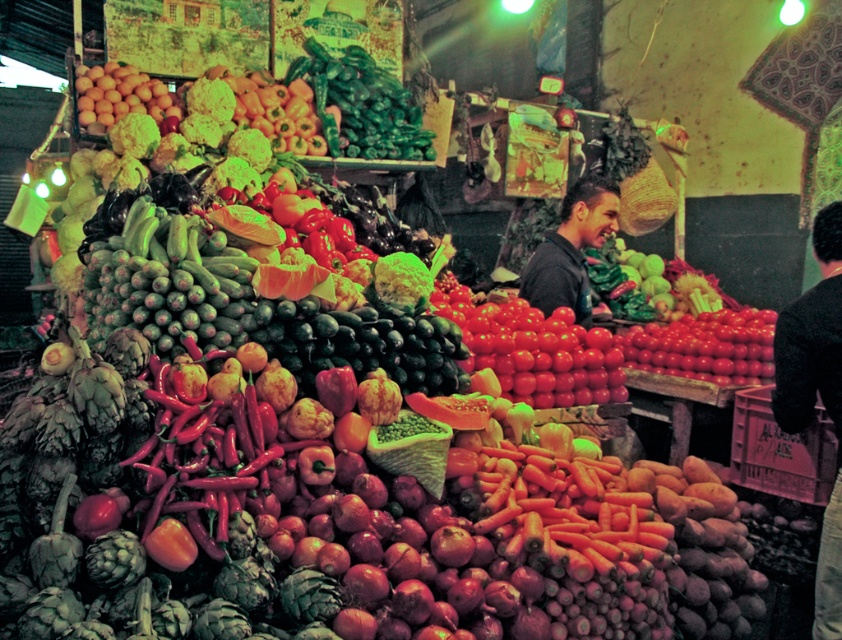
You are a customer at the market and want to place the smooth red chili pepper at center into a bag that can only hold items shorter than the black matte shirt at center. Can the chili pepper fit in the bag?

The smooth red chili pepper at center is shorter than the black matte shirt at center, so it can fit into the bag designed for items shorter than the shirt.

Based on the photo, you are a customer browsing through a clothing rack at a store. You see a black sweater at right and a black matte shirt at center. Which item is positioned more to the right side of the rack?

The black sweater at right is positioned more to the right side of the rack compared to the black matte shirt at center, as it is located to the right of the shirt.

You are a customer at the market and want to find the smooth red chili pepper at center. According to the image coordinates, where exactly is it located?

The smooth red chili pepper at center is located at the 2D coordinates point of (x=216, y=449).